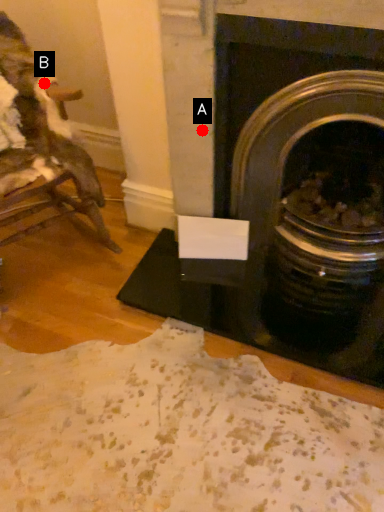
Question: Two points are circled on the image, labeled by A and B beside each circle. Which point is farther from the camera taking this photo?

Choices:
 (A) A is further
 (B) B is further

Answer: (B)